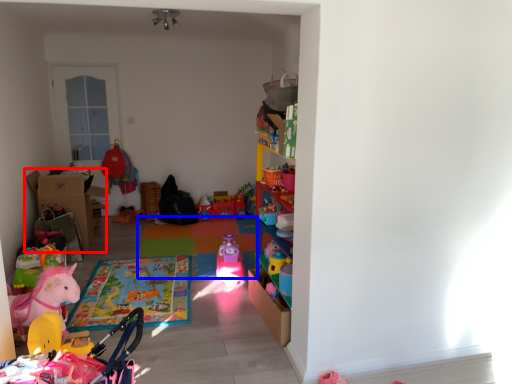
Question: Which point is further to the camera, cardboard box (highlighted by a red box) or plain (highlighted by a blue box)?

Choices:
 (A) cardboard box
 (B) plain

Answer: (A)